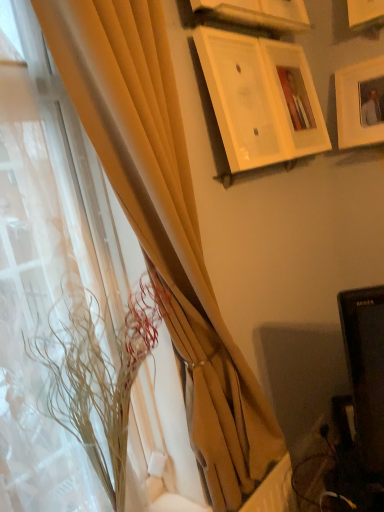
This screenshot has height=512, width=384. I want to click on matte yellow curtain at left, positioned as the 2th curtain in right-to-left order, so click(x=40, y=288).

What do you see at coordinates (257, 13) in the screenshot?
I see `wooden picture frame at upper center, the second picture frame when ordered from left to right` at bounding box center [257, 13].

The height and width of the screenshot is (512, 384). Find the location of `dry grass at left`. dry grass at left is located at coordinates (98, 373).

Measure the distance from white glossy picture frame at upper center, the 1th picture frame from the left, to wooden picture frame at upper center, the 3th picture frame in the right-to-left sequence.

They are 8.86 inches apart.

From a real-world perspective, count 2nd picture frames downward from the wooden picture frame at upper center, the second picture frame when ordered from left to right, and point to it. Please provide its 2D coordinates.

[(259, 98)]

Considering the positions of objects white glossy picture frame at upper center, the 4th picture frame from the right, and wooden picture frame at upper center, the second picture frame when ordered from left to right, in the image provided, who is more to the right, white glossy picture frame at upper center, the 4th picture frame from the right, or wooden picture frame at upper center, the second picture frame when ordered from left to right,?

wooden picture frame at upper center, the second picture frame when ordered from left to right, is more to the right.

Is white glossy picture frame at upper center, the 4th picture frame from the right, aimed at wooden picture frame at upper center, the 3th picture frame in the right-to-left sequence?

No, white glossy picture frame at upper center, the 4th picture frame from the right, does not turn towards wooden picture frame at upper center, the 3th picture frame in the right-to-left sequence.

Can you tell me how much matte yellow curtain at left, positioned as the 2th curtain in right-to-left order, and white glossy picture frame at upper center, the 4th picture frame from the right, differ in facing direction?

The angle between the facing direction of matte yellow curtain at left, positioned as the 2th curtain in right-to-left order, and the facing direction of white glossy picture frame at upper center, the 4th picture frame from the right, is 1.43 degrees.

Is matte yellow curtain at left, positioned as the 2th curtain in right-to-left order, wider than white glossy picture frame at upper center, the 4th picture frame from the right?

Yes.

Would you say matte yellow curtain at left, positioned as the 2th curtain in right-to-left order, contains white glossy picture frame at upper center, the 1th picture frame from the left?

No, white glossy picture frame at upper center, the 1th picture frame from the left, is not a part of matte yellow curtain at left, positioned as the 2th curtain in right-to-left order.

From a real-world perspective, which is physically above, matte yellow curtain at left, the 1th curtain positioned from the left, or white glossy picture frame at upper center, the 4th picture frame from the right?

From a 3D spatial view, white glossy picture frame at upper center, the 4th picture frame from the right, is above.

From a real-world perspective, does wooden picture frame at upper center, the 3th picture frame in the right-to-left sequence, stand above matte yellow curtain at left, the second curtain in the left-to-right sequence?

Yes, from a real-world perspective, wooden picture frame at upper center, the 3th picture frame in the right-to-left sequence, is over matte yellow curtain at left, the second curtain in the left-to-right sequence

In the scene shown: Is wooden picture frame at upper center, the 3th picture frame in the right-to-left sequence, inside the boundaries of matte yellow curtain at left, arranged as the first curtain when viewed from the right, or outside?

wooden picture frame at upper center, the 3th picture frame in the right-to-left sequence, is not enclosed by matte yellow curtain at left, arranged as the first curtain when viewed from the right.

Considering the relative positions of wooden picture frame at upper center, the 3th picture frame in the right-to-left sequence, and matte yellow curtain at left, arranged as the first curtain when viewed from the right, in the image provided, is wooden picture frame at upper center, the 3th picture frame in the right-to-left sequence, to the left of matte yellow curtain at left, arranged as the first curtain when viewed from the right, from the viewer's perspective?

No.

What's the angular difference between wooden picture frame at upper center, the 3th picture frame in the right-to-left sequence, and matte yellow curtain at left, arranged as the first curtain when viewed from the right,'s facing directions?

There is a 0.771-degree angle between the facing directions of wooden picture frame at upper center, the 3th picture frame in the right-to-left sequence, and matte yellow curtain at left, arranged as the first curtain when viewed from the right.

Considering the relative sizes of white matte picture frame at upper right, which is the first picture frame from right to left, and wooden picture frame at upper center, the second picture frame when ordered from left to right, in the image provided, is white matte picture frame at upper right, which is the first picture frame from right to left, bigger than wooden picture frame at upper center, the second picture frame when ordered from left to right,?

Yes, white matte picture frame at upper right, which is the first picture frame from right to left, is bigger than wooden picture frame at upper center, the second picture frame when ordered from left to right.

Would you say white matte picture frame at upper right, the fourth picture frame in the left-to-right sequence, is inside or outside wooden picture frame at upper center, the second picture frame when ordered from left to right?

The correct answer is: outside.

From a real-world perspective, is white matte picture frame at upper right, which is the first picture frame from right to left, above or below wooden picture frame at upper center, the second picture frame when ordered from left to right?

white matte picture frame at upper right, which is the first picture frame from right to left, is situated lower than wooden picture frame at upper center, the second picture frame when ordered from left to right, in the real world.

Which is more to the left, dry grass at left or wooden picture frame at upper center, the 3th picture frame in the right-to-left sequence?

dry grass at left is more to the left.

Is dry grass at left situated inside wooden picture frame at upper center, the 3th picture frame in the right-to-left sequence, or outside?

dry grass at left is outside wooden picture frame at upper center, the 3th picture frame in the right-to-left sequence.

In the scene shown: Is dry grass at left facing away from wooden picture frame at upper center, the 3th picture frame in the right-to-left sequence?

No, dry grass at left is not facing the opposite direction of wooden picture frame at upper center, the 3th picture frame in the right-to-left sequence.

Does point (133, 337) come closer to viewer compared to point (264, 13)?

Yes, it is in front of point (264, 13).

Can you tell me how much dry grass at left and white glossy picture frame at upper center, the 4th picture frame from the right, differ in facing direction?

The angle between the facing direction of dry grass at left and the facing direction of white glossy picture frame at upper center, the 4th picture frame from the right, is 0.27 degrees.

Is dry grass at left aimed at white glossy picture frame at upper center, the 4th picture frame from the right?

No, dry grass at left is not turned towards white glossy picture frame at upper center, the 4th picture frame from the right.

Which object is further away from the camera taking this photo, dry grass at left or white glossy picture frame at upper center, the 1th picture frame from the left?

white glossy picture frame at upper center, the 1th picture frame from the left.

Which is more to the right, dry grass at left or white glossy picture frame at upper center, the 4th picture frame from the right?

From the viewer's perspective, white glossy picture frame at upper center, the 4th picture frame from the right, appears more on the right side.

Based on the photo, is white matte picture frame at upper right, the fourth picture frame in the left-to-right sequence, shorter than dry grass at left?

Indeed, white matte picture frame at upper right, the fourth picture frame in the left-to-right sequence, has a lesser height compared to dry grass at left.

Is the surface of white matte picture frame at upper right, the fourth picture frame in the left-to-right sequence, in direct contact with dry grass at left?

No, white matte picture frame at upper right, the fourth picture frame in the left-to-right sequence, is not beside dry grass at left.

Is the position of white matte picture frame at upper right, the fourth picture frame in the left-to-right sequence, less distant than that of dry grass at left?

That is False.

Is white matte picture frame at upper right, the fourth picture frame in the left-to-right sequence, to the left or to the right of dry grass at left in the image?

white matte picture frame at upper right, the fourth picture frame in the left-to-right sequence, is to the right of dry grass at left.

Identify the location of the 2nd picture frame directly above the white glossy picture frame at upper center, the 1th picture frame from the left (from a real-world perspective). The height and width of the screenshot is (512, 384). (257, 13).

From a real-world perspective, starting from the white glossy picture frame at upper center, the 1th picture frame from the left, which curtain is the 1st one below it? Please provide its 2D coordinates.

[(40, 288)]

Based on their spatial positions, is white matte picture frame at upper right, the fourth picture frame in the left-to-right sequence, or wooden picture frame at upper center, which is counted as the 2th picture frame, starting from the right, closer to wooden picture frame at upper center, the second picture frame when ordered from left to right?

wooden picture frame at upper center, which is counted as the 2th picture frame, starting from the right.

Estimate the real-world distances between objects in this image. Which object is further from wooden picture frame at upper center, which is counted as the 2th picture frame, starting from the right, wooden picture frame at upper center, the second picture frame when ordered from left to right, or matte yellow curtain at left, the second curtain in the left-to-right sequence?

Based on the image, matte yellow curtain at left, the second curtain in the left-to-right sequence, appears to be further to wooden picture frame at upper center, which is counted as the 2th picture frame, starting from the right.

Based on their spatial positions, is white matte picture frame at upper right, the fourth picture frame in the left-to-right sequence, or matte yellow curtain at left, arranged as the first curtain when viewed from the right, further from wooden picture frame at upper center, the 3th picture frame in the right-to-left sequence?

Based on the image, matte yellow curtain at left, arranged as the first curtain when viewed from the right, appears to be further to wooden picture frame at upper center, the 3th picture frame in the right-to-left sequence.

Estimate the real-world distances between objects in this image. Which object is further from dry grass at left, white matte picture frame at upper right, which is the first picture frame from right to left, or matte yellow curtain at left, positioned as the 2th curtain in right-to-left order?

Among the two, white matte picture frame at upper right, which is the first picture frame from right to left, is located further to dry grass at left.

Estimate the real-world distances between objects in this image. Which object is further from matte yellow curtain at left, the 1th curtain positioned from the left, wooden picture frame at upper center, the 3th picture frame in the right-to-left sequence, or matte yellow curtain at left, arranged as the first curtain when viewed from the right?

wooden picture frame at upper center, the 3th picture frame in the right-to-left sequence, lies further to matte yellow curtain at left, the 1th curtain positioned from the left, than the other object.

Which object lies nearer to the anchor point matte yellow curtain at left, the 1th curtain positioned from the left, white glossy picture frame at upper center, the 1th picture frame from the left, or wooden picture frame at upper center, which is counted as the 2th picture frame, starting from the right?

The object closer to matte yellow curtain at left, the 1th curtain positioned from the left, is white glossy picture frame at upper center, the 1th picture frame from the left.

Estimate the real-world distances between objects in this image. Which object is closer to dry grass at left, matte yellow curtain at left, arranged as the first curtain when viewed from the right, or wooden picture frame at upper center, which is counted as the 2th picture frame, starting from the right?

matte yellow curtain at left, arranged as the first curtain when viewed from the right, lies closer to dry grass at left than the other object.

Considering their positions, is white glossy picture frame at upper center, the 1th picture frame from the left, positioned further to wooden picture frame at upper center, the second picture frame when ordered from left to right, than white matte picture frame at upper right, the fourth picture frame in the left-to-right sequence?

Based on the image, white matte picture frame at upper right, the fourth picture frame in the left-to-right sequence, appears to be further to wooden picture frame at upper center, the second picture frame when ordered from left to right.

Where is `picture frame between wooden picture frame at upper center, which is counted as the 2th picture frame, starting from the right, and matte yellow curtain at left, arranged as the first curtain when viewed from the right, from top to bottom`? The image size is (384, 512). picture frame between wooden picture frame at upper center, which is counted as the 2th picture frame, starting from the right, and matte yellow curtain at left, arranged as the first curtain when viewed from the right, from top to bottom is located at coordinates (259, 98).

Locate an element on the screen. curtain between matte yellow curtain at left, the 1th curtain positioned from the left, and white matte picture frame at upper right, which is the first picture frame from right to left, from left to right is located at coordinates (165, 224).

What are the coordinates of `curtain between wooden picture frame at upper center, the 3th picture frame in the right-to-left sequence, and matte yellow curtain at left, positioned as the 2th curtain in right-to-left order, vertically` in the screenshot? It's located at (165, 224).

At what (x,y) coordinates should I click in order to perform the action: click on flower between matte yellow curtain at left, positioned as the 2th curtain in right-to-left order, and white matte picture frame at upper right, which is the first picture frame from right to left, from left to right. Please return your answer as a coordinate pair (x, y). Looking at the image, I should click on pyautogui.click(x=98, y=373).